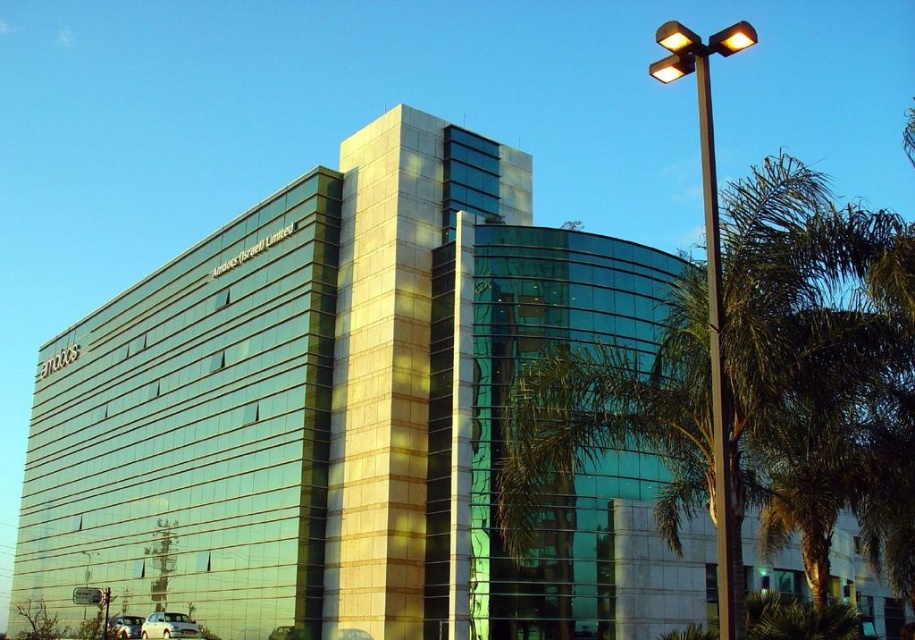
Can you confirm if green leafy palm tree at right is bigger than black metal pole at right?

No.

Is green leafy palm tree at right taller than black metal pole at right?

In fact, green leafy palm tree at right may be shorter than black metal pole at right.

Does point (705, 356) lie in front of point (706, 125)?

Yes, it is.

This screenshot has width=915, height=640. I want to click on green leafy palm tree at right, so click(x=817, y=369).